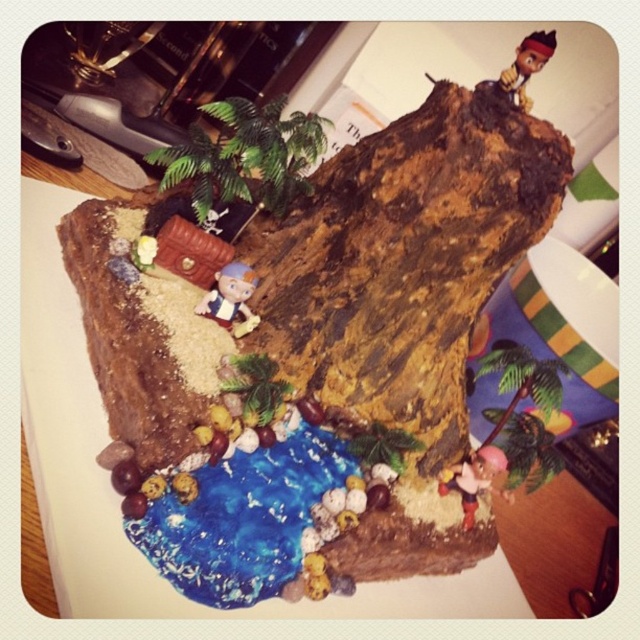
You are a customer at a bakery and see this cake. The brown sugar pirate ship at center is located at point (x=321, y=352). The cake is displayed on a round table. If you want to place a candle exactly at the center of the table, where should you place it relative to the brown sugar pirate ship at center?

The brown sugar pirate ship at center is located at point (x=321, y=352), so the candle should be placed at the center of the table, which is the same point as the brown sugar pirate ship at center.

You are a cake decorator who needs to place a small chocolate coin on the cake. The brown sugar pirate ship at center and the smooth brown figurine at upper right are already on the cake. Which object should you place the coin closer to if you want it to be near the smaller item?

The smooth brown figurine at upper right is smaller than the brown sugar pirate ship at center, so you should place the coin closer to the smooth brown figurine at upper right.

You are standing at the center of the cake and looking towards the pirate island. There are two points marked on the cake surface. One is at point (170, 324) and the other is at point (518, 99). Which point is closer to you?

Point (170, 324) is in front of point (518, 99), so it is closer to you.